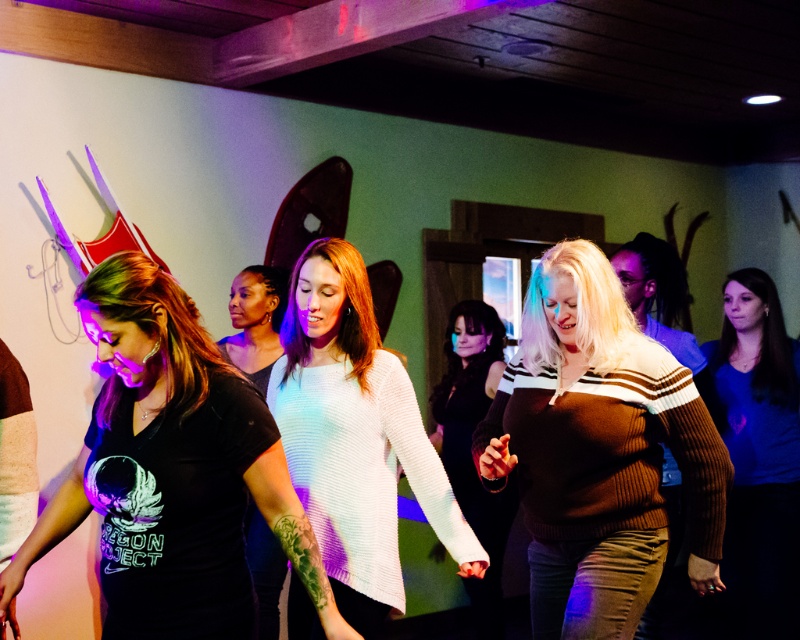
You are organizing a clothing donation drive and need to determine if the white knitted sweater at center can be placed on top of the knit sweater at center without damaging either. Based on their positions in the image, is this feasible?

The white knitted sweater at center is positioned over the knit sweater at center, indicating it can be placed on top without causing damage.

You are organizing a clothing donation drive and need to determine which of the two sweaters, the brown ribbed sweater at center or the knit sweater at center, can fit into a standard donation box that can only hold items taking up less space. Which sweater should you choose?

The brown ribbed sweater at center occupies less space than the knit sweater at center, so you should choose the brown ribbed sweater at center for the donation box.